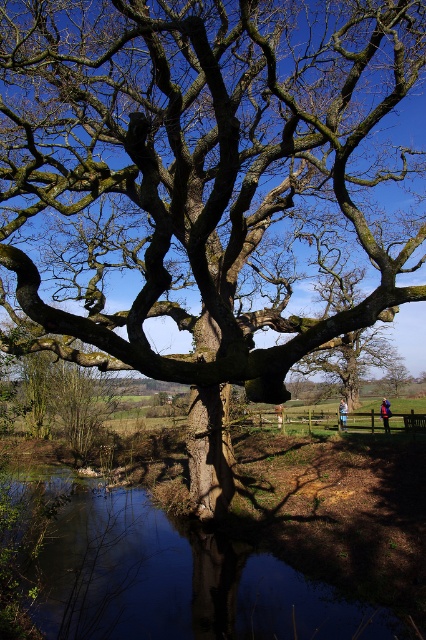
Which is more to the right, smooth reflective water at lower center or blue fabric jacket at center?

From the viewer's perspective, blue fabric jacket at center appears more on the right side.

Is point (62, 602) closer to camera compared to point (386, 412)?

Yes, point (62, 602) is closer to viewer.

The width and height of the screenshot is (426, 640). Find the location of `smooth reflective water at lower center`. smooth reflective water at lower center is located at coordinates (158, 573).

Who is higher up, blue fabric jacket at center or blue fabric jacket at lower right?

blue fabric jacket at center is higher up.

Measure the distance between point [388,426] and camera.

They are 20.96 meters apart.

I want to click on blue fabric jacket at center, so click(x=385, y=413).

The image size is (426, 640). What do you see at coordinates (158, 573) in the screenshot?
I see `smooth reflective water at lower center` at bounding box center [158, 573].

Between smooth reflective water at lower center and blue fabric jacket at lower right, which one has less height?

With less height is blue fabric jacket at lower right.

Does point (34, 532) come closer to viewer compared to point (342, 400)?

Yes.

Find the location of a particular element. The image size is (426, 640). smooth reflective water at lower center is located at coordinates (158, 573).